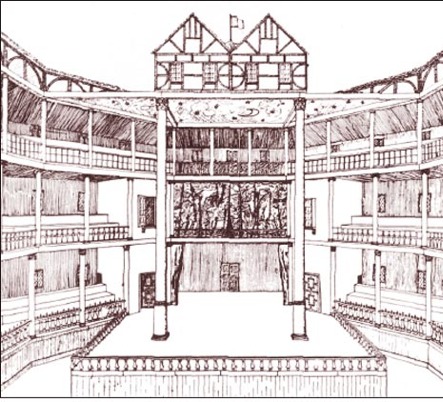
Image resolution: width=443 pixels, height=402 pixels. Identify the location of columns. (30, 273), (80, 261).